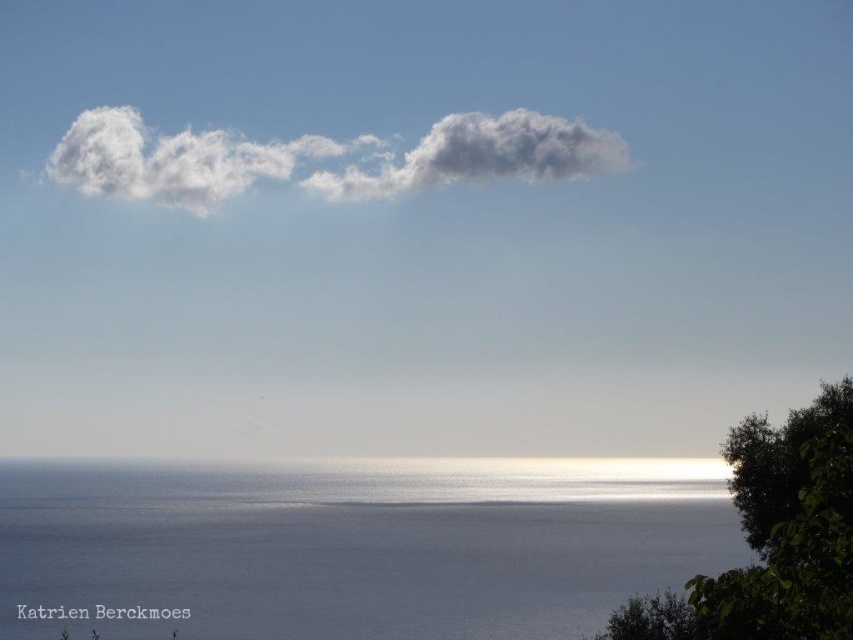
Question: Considering the relative positions of blue smooth water at lower center and white fluffy cloud at upper center in the image provided, where is blue smooth water at lower center located with respect to white fluffy cloud at upper center?

Choices:
 (A) below
 (B) above

Answer: (A)

Question: Which point is closer to the camera?

Choices:
 (A) (345, 536)
 (B) (457, 173)
 (C) (642, 627)

Answer: (C)

Question: Is white fluffy cloud at upper center wider than green leafy tree at lower right?

Choices:
 (A) no
 (B) yes

Answer: (B)

Question: Which point appears farthest from the camera in this image?

Choices:
 (A) (564, 513)
 (B) (630, 627)

Answer: (A)

Question: Does white fluffy cloud at upper center appear under green leafy tree at lower right?

Choices:
 (A) yes
 (B) no

Answer: (B)

Question: Among these objects, which one is nearest to the camera?

Choices:
 (A) blue smooth water at lower center
 (B) white fluffy cloud at upper center

Answer: (A)